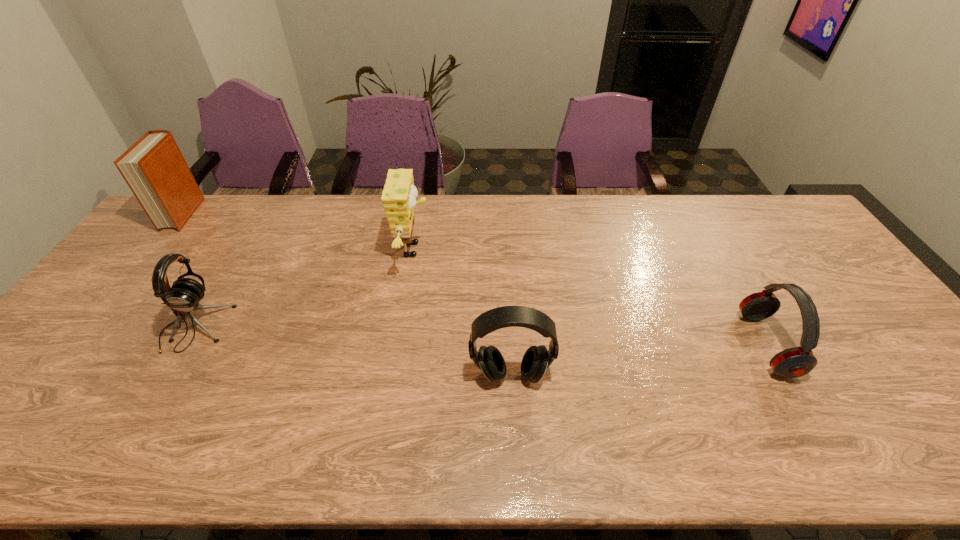
Where is `free space between the leftmost earphone and the second object from right to left`? free space between the leftmost earphone and the second object from right to left is located at coordinates (352, 352).

What are the coordinates of `empty space between the third object from right to left and the leftmost earphone` in the screenshot? It's located at (304, 289).

Locate an element on the screen. The height and width of the screenshot is (540, 960). free spot between the second earphone from right to left and the sponge is located at coordinates (462, 312).

This screenshot has width=960, height=540. Identify the location of vacant space in between the second earphone from right to left and the shortest object. (638, 360).

Find the location of `free point between the leftmost object and the third object from left to right`. free point between the leftmost object and the third object from left to right is located at coordinates (299, 232).

Locate an element on the screen. This screenshot has height=540, width=960. vacant region between the sponge and the leftmost earphone is located at coordinates (304, 289).

The width and height of the screenshot is (960, 540). Identify the location of blank region between the shortest object and the sponge. (590, 297).

Identify the location of empty location between the sponge and the leftmost earphone. This screenshot has width=960, height=540. (304, 289).

This screenshot has height=540, width=960. What are the coordinates of `object that stands as the closest to the leftmost earphone` in the screenshot? It's located at (154, 168).

At what (x,y) coordinates should I click in order to perform the action: click on object that ranks as the fourth closest to the fourth object from right to left. Please return your answer as a coordinate pair (x, y). This screenshot has width=960, height=540. Looking at the image, I should click on (794, 362).